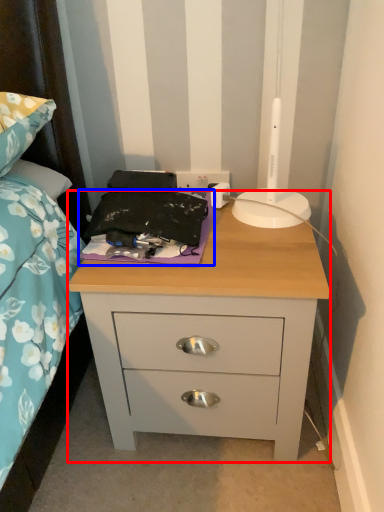
Question: Which object appears closest to the camera in this image, nightstand (highlighted by a red box) or sheet (highlighted by a blue box)?

Choices:
 (A) nightstand
 (B) sheet

Answer: (A)